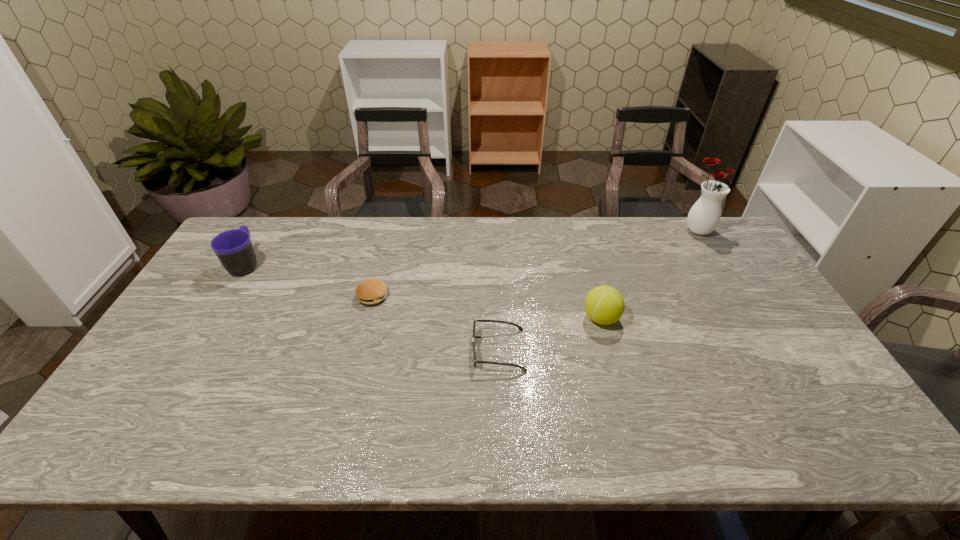
The width and height of the screenshot is (960, 540). I want to click on object that is at the far left corner, so click(234, 249).

I want to click on object that is positioned at the far right corner, so click(x=704, y=216).

Locate an element on the screen. This screenshot has height=540, width=960. vacant region at the far edge of the desktop is located at coordinates (649, 222).

You are a GUI agent. You are given a task and a screenshot of the screen. Output one action in this format:
    pyautogui.click(x=<x>, y=<y>)
    Task: Click on the free spot at the near edge of the desktop
    Image resolution: width=960 pixels, height=540 pixels.
    Given the screenshot: What is the action you would take?
    tap(679, 442)

Locate an element on the screen. free space at the left edge of the desktop is located at coordinates (234, 299).

The image size is (960, 540). In order to click on vacant space at the right edge of the desktop in this screenshot , I will do `click(788, 365)`.

Identify the location of free space at the far left corner of the desktop. Image resolution: width=960 pixels, height=540 pixels. (271, 232).

This screenshot has height=540, width=960. Identify the location of free region at the far right corner. (705, 249).

The height and width of the screenshot is (540, 960). What are the coordinates of `vacant area between the second farthest object and the third object from right to left` in the screenshot? It's located at (372, 307).

Image resolution: width=960 pixels, height=540 pixels. I want to click on vacant area that lies between the tennis ball and the third object from right to left, so click(x=549, y=334).